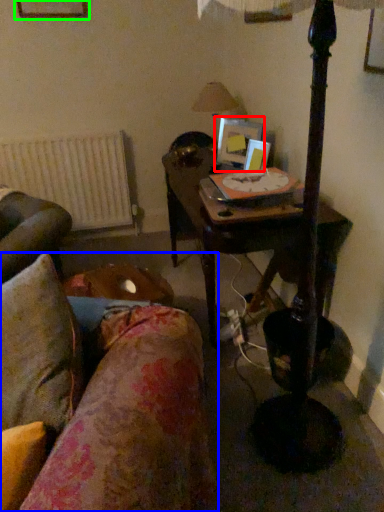
Question: Which object is the farthest from picture frame (highlighted by a red box)? Choose among these: studio couch (highlighted by a blue box) or picture frame (highlighted by a green box).

Choices:
 (A) studio couch
 (B) picture frame

Answer: (A)